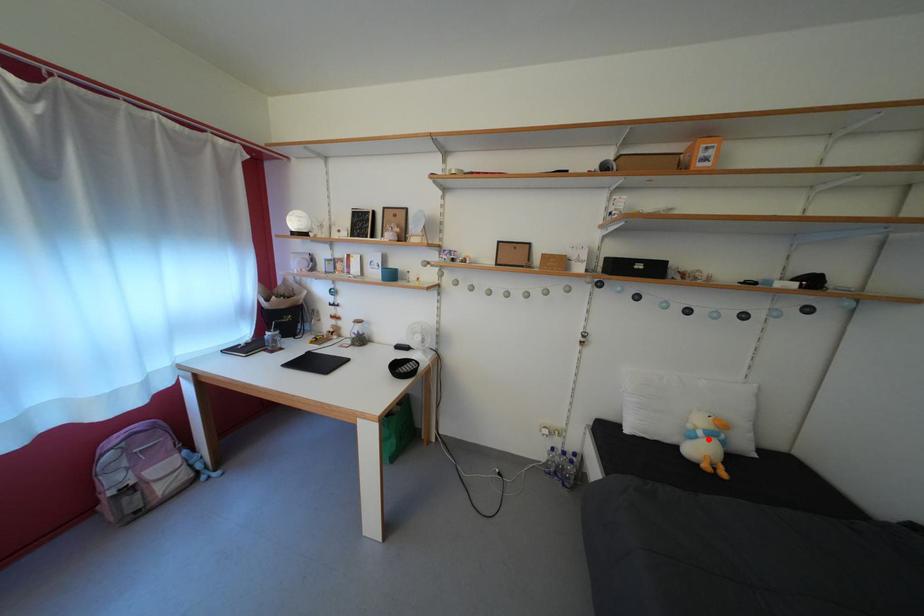
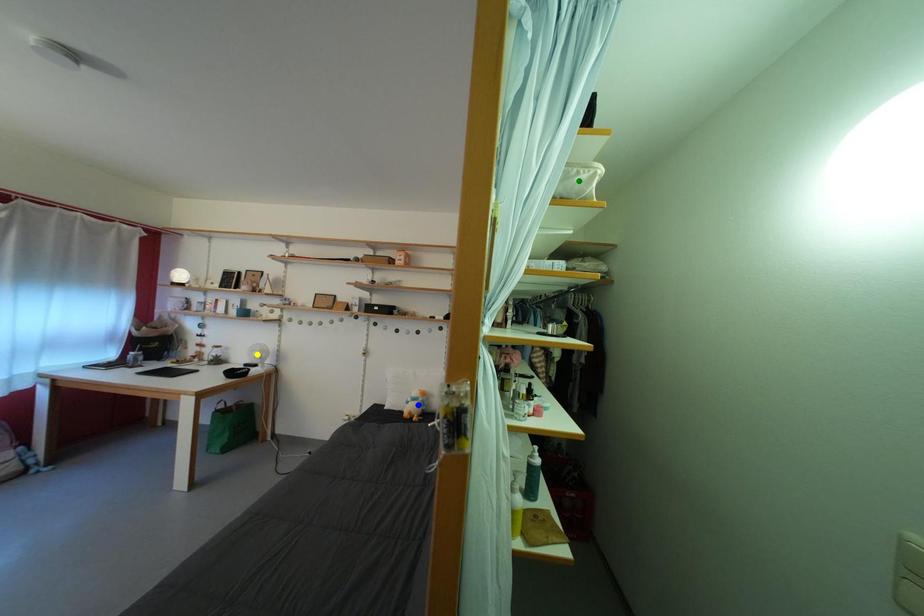
Question: I am providing you with two images of the same scene from different viewpoints. A red point is marked on the first image. You are given multiple points on the second image. Which mark in image 2 goes with the point in image 1?

Choices:
 (A) green point
 (B) blue point
 (C) yellow point

Answer: (B)